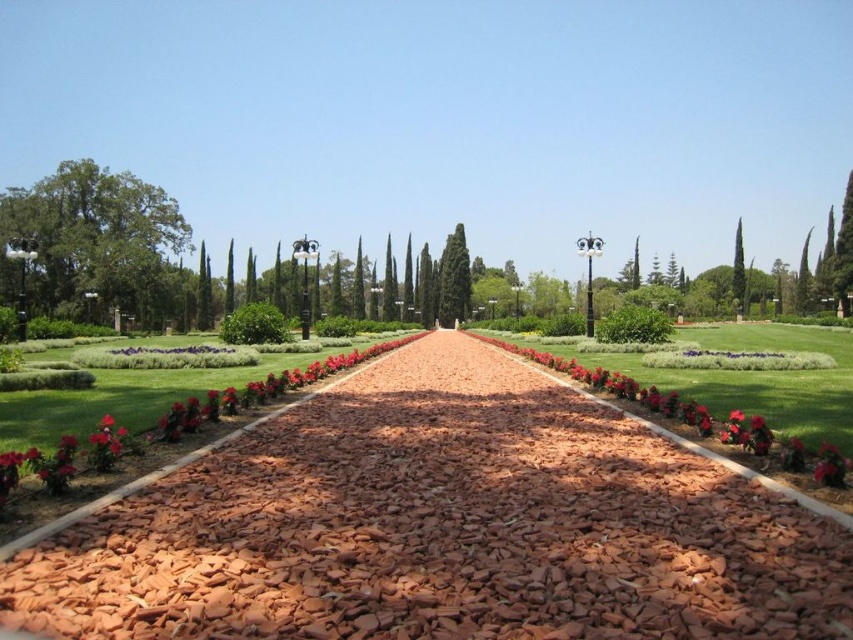
Question: Which object is farther from the camera taking this photo?

Choices:
 (A) green textured cypress at center
 (B) green leafy tree at left
 (C) red brick pathway at center
 (D) green textured cypress at right

Answer: (A)

Question: Among these points, which one is nearest to the camera?

Choices:
 (A) (740, 227)
 (B) (270, 541)
 (C) (466, 269)

Answer: (B)

Question: Observing the image, what is the correct spatial positioning of red brick pathway at center in reference to green textured cypress at center?

Choices:
 (A) below
 (B) above

Answer: (A)

Question: Does green leafy tree at left have a lesser width compared to green textured cypress at right?

Choices:
 (A) no
 (B) yes

Answer: (B)

Question: Where is green leafy tree at left located in relation to green textured cypress at center in the image?

Choices:
 (A) right
 (B) left

Answer: (B)

Question: Which is nearer to the green textured cypress at center?

Choices:
 (A) green textured cypress at right
 (B) red brick pathway at center

Answer: (A)